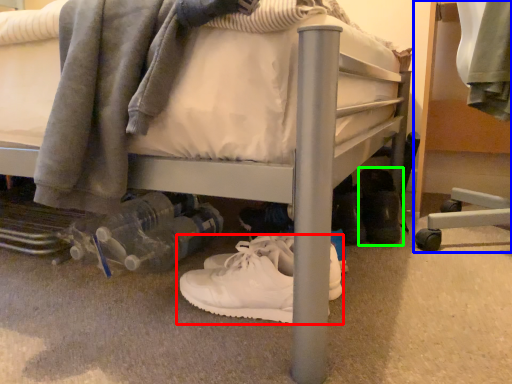
Question: Considering the real-world distances, which object is farthest from footwear (highlighted by a red box)? furniture (highlighted by a blue box) or footwear (highlighted by a green box)?

Choices:
 (A) furniture
 (B) footwear

Answer: (A)